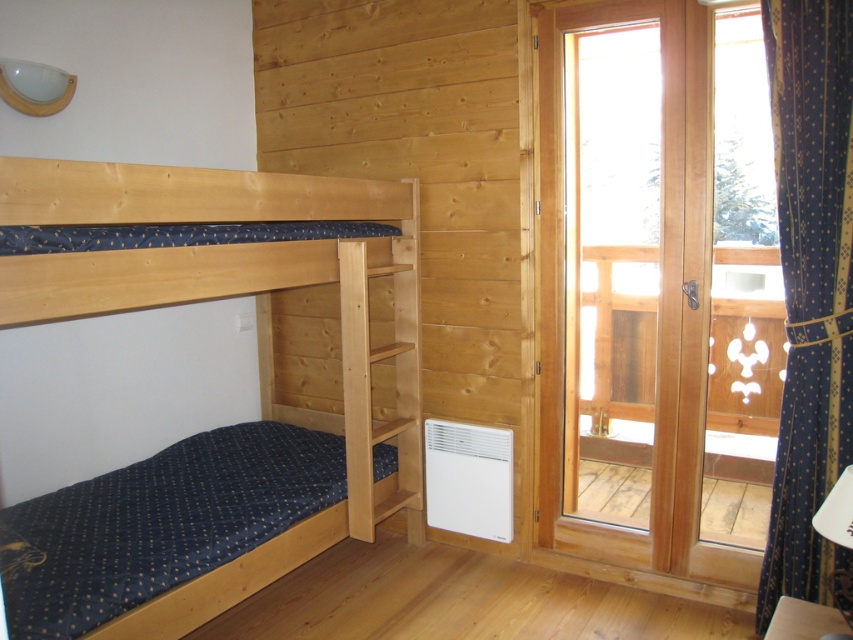
Question: Is natural wood bunk bed at left above blue textured curtain at right?

Choices:
 (A) yes
 (B) no

Answer: (B)

Question: Is natural wood bunk bed at left above blue textured curtain at right?

Choices:
 (A) yes
 (B) no

Answer: (B)

Question: Which point is closer to the camera?

Choices:
 (A) transparent wooden glass door at right
 (B) natural wood bunk bed at left
 (C) blue textured curtain at right

Answer: (B)

Question: Which of the following is the closest to the observer?

Choices:
 (A) blue textured curtain at right
 (B) natural wood bunk bed at left

Answer: (B)

Question: Can you confirm if transparent wooden glass door at right is positioned to the left of blue textured curtain at right?

Choices:
 (A) no
 (B) yes

Answer: (B)

Question: Which point is closer to the camera taking this photo?

Choices:
 (A) (782, 154)
 (B) (352, 304)
 (C) (549, 454)

Answer: (A)